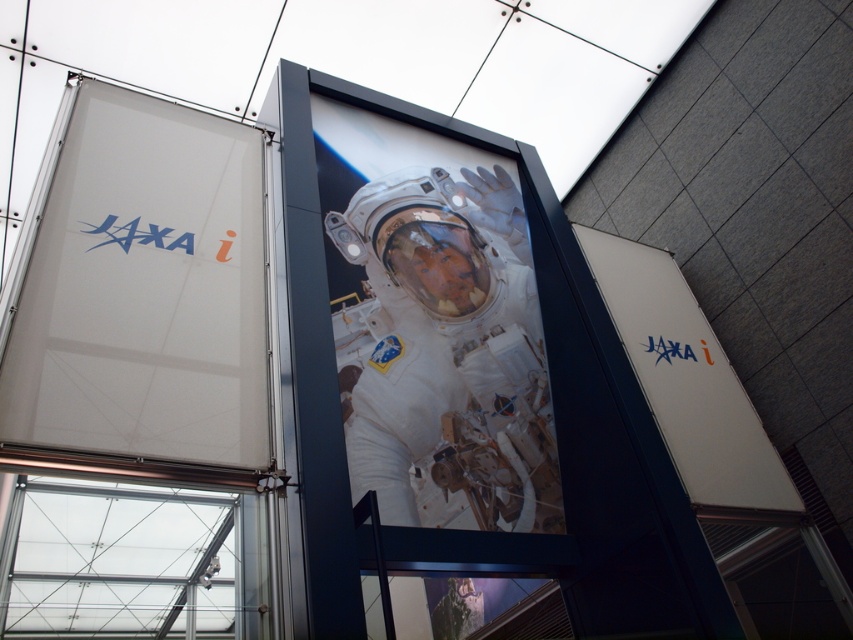
Can you confirm if white fabric sign at upper left is shorter than white matte sign at center?

Indeed, white fabric sign at upper left has a lesser height compared to white matte sign at center.

Is white fabric sign at upper left taller than white matte sign at center?

No.

I want to click on white fabric sign at upper left, so click(x=138, y=292).

The image size is (853, 640). What are the coordinates of `white fabric sign at upper left` in the screenshot? It's located at (138, 292).

Which of these two, white fabric sign at upper left or white matte astronaut at center, stands taller?

With more height is white matte astronaut at center.

Is white fabric sign at upper left below white matte astronaut at center?

No.

What do you see at coordinates (138, 292) in the screenshot? I see `white fabric sign at upper left` at bounding box center [138, 292].

Image resolution: width=853 pixels, height=640 pixels. Identify the location of white fabric sign at upper left. (138, 292).

Does point (445, 221) lie behind point (711, 458)?

Yes, it is.

Locate an element on the screen. The height and width of the screenshot is (640, 853). white matte astronaut at center is located at coordinates (445, 355).